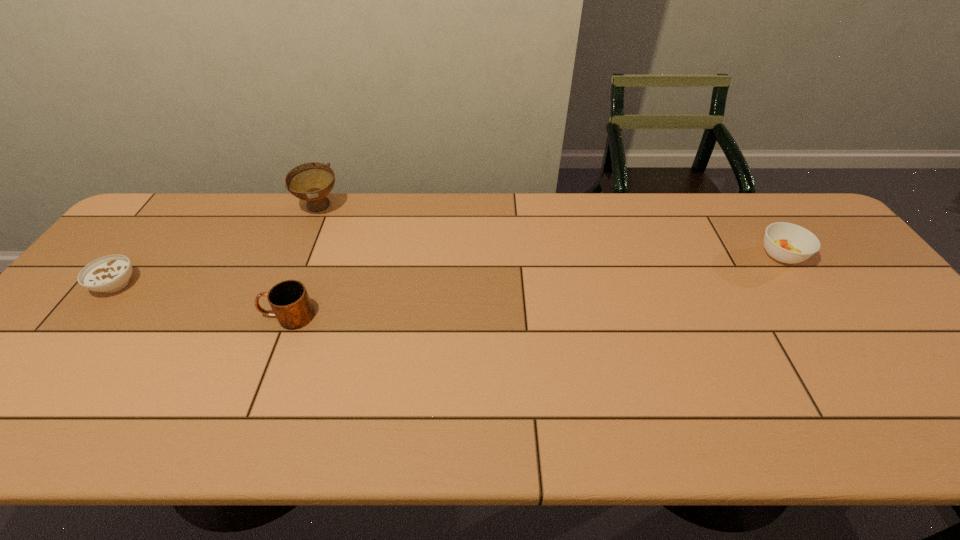
This screenshot has height=540, width=960. Find the location of `free region located on the side of the second tallest object with the handle`. free region located on the side of the second tallest object with the handle is located at coordinates coord(114,316).

Find the location of a particular element. This screenshot has height=540, width=960. blank space located on the side of the second tallest object with the handle is located at coordinates (130, 316).

At what (x,y) coordinates should I click in order to perform the action: click on free space located on the left of the rightmost soup bowl. Please return your answer as a coordinate pair (x, y). The width and height of the screenshot is (960, 540). Looking at the image, I should click on 702,255.

In order to click on free location located 0.170m on the right of the shortest soup bowl in this screenshot , I will do `click(202, 284)`.

Image resolution: width=960 pixels, height=540 pixels. Identify the location of object that is positioned at the left edge. (111, 273).

Identify the location of object positioned at the right edge. The height and width of the screenshot is (540, 960). (785, 242).

The height and width of the screenshot is (540, 960). I want to click on object present at the far right corner, so click(785, 242).

At what (x,y) coordinates should I click in order to perform the action: click on vacant region at the far edge of the desktop. Please return your answer as a coordinate pair (x, y). The image size is (960, 540). Looking at the image, I should click on (594, 231).

Where is `vacant area at the right edge of the desktop`? The height and width of the screenshot is (540, 960). vacant area at the right edge of the desktop is located at coordinates (849, 288).

You are a GUI agent. You are given a task and a screenshot of the screen. Output one action in this format:
    pyautogui.click(x=<x>, y=<y>)
    Task: Click on the free spot at the far left corner of the desktop
    
    Given the screenshot: What is the action you would take?
    pyautogui.click(x=184, y=230)